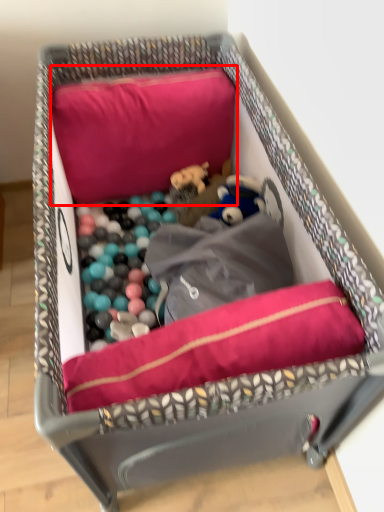
Question: From the image's perspective, where is pillow (annotated by the red box) located in relation to dog bed in the image?

Choices:
 (A) below
 (B) above

Answer: (B)